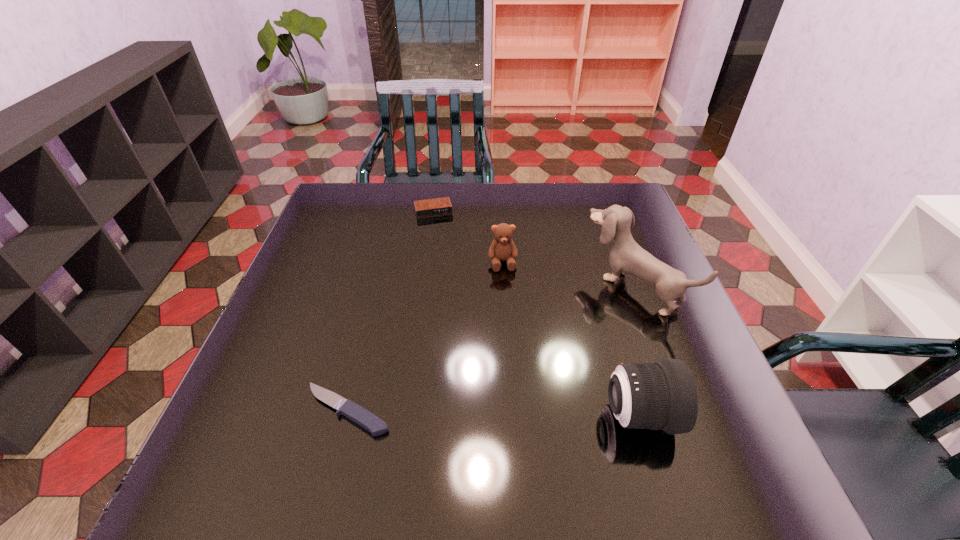
Where is `telephoto lens that is at the near edge`? The width and height of the screenshot is (960, 540). telephoto lens that is at the near edge is located at coordinates (662, 395).

Identify the location of object at the left edge. (356, 413).

Where is `telephoto lens situated at the right edge`? The image size is (960, 540). telephoto lens situated at the right edge is located at coordinates (662, 395).

Where is `puppy situated at the right edge`? This screenshot has width=960, height=540. puppy situated at the right edge is located at coordinates (626, 256).

You are a GUI agent. You are given a task and a screenshot of the screen. Output one action in this format:
    pyautogui.click(x=<x>, y=<y>)
    Task: Click on the object present at the near left corner
    The width and height of the screenshot is (960, 540).
    Given the screenshot: What is the action you would take?
    pyautogui.click(x=356, y=413)

Locate an element on the screen. Image resolution: width=960 pixels, height=540 pixels. object that is at the near right corner is located at coordinates (662, 395).

In the image, there is a desktop. Where is `vacant space at the far edge`? vacant space at the far edge is located at coordinates (411, 213).

What are the coordinates of `vacant space at the left edge of the desktop` in the screenshot? It's located at (320, 305).

The image size is (960, 540). I want to click on blank area at the right edge, so click(x=609, y=246).

Identify the location of free space at the far left corner of the desktop. (358, 194).